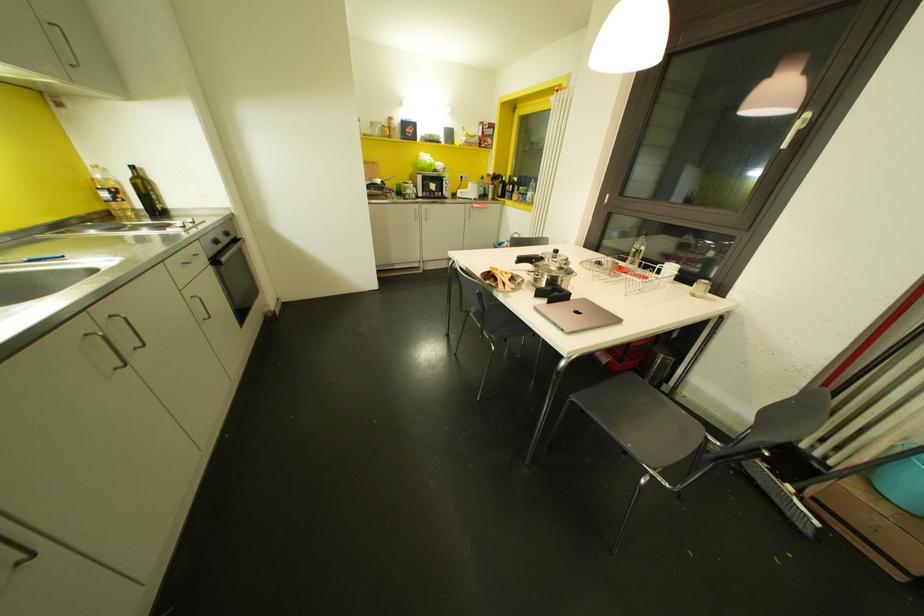
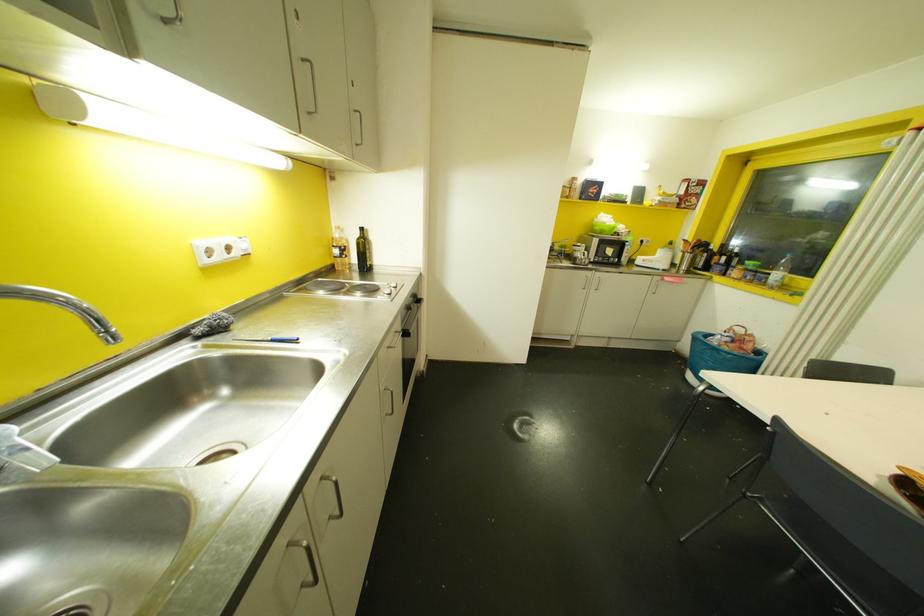
Locate, in the second image, the point that corresponds to point (132, 168) in the first image.

(360, 229)